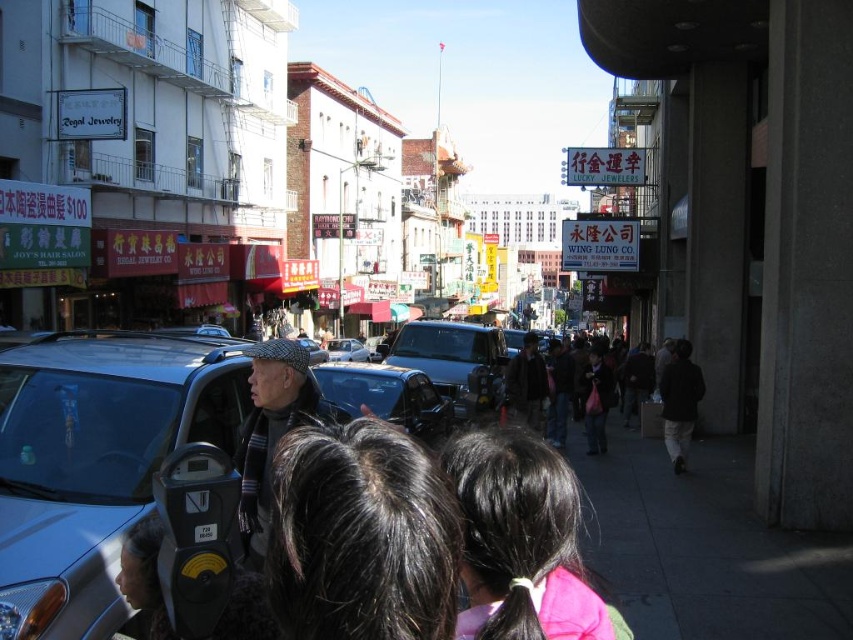
Can you confirm if gray concrete sidewalk at lower right is positioned to the left of metallic blue taxi at center?

Incorrect, gray concrete sidewalk at lower right is not on the left side of metallic blue taxi at center.

Between gray concrete sidewalk at lower right and metallic blue taxi at center, which one is positioned higher?

metallic blue taxi at center is higher up.

Is point (813, 595) positioned before point (384, 397)?

Yes, it is.

Image resolution: width=853 pixels, height=640 pixels. I want to click on gray concrete sidewalk at lower right, so click(x=704, y=547).

Which is in front, point (569, 524) or point (395, 356)?

Point (569, 524) is in front.

This screenshot has height=640, width=853. In order to click on black hair at center in this screenshot , I will do `click(521, 540)`.

Is dark brown hair at center to the right of black hair at center from the viewer's perspective?

Incorrect, dark brown hair at center is not on the right side of black hair at center.

Does point (294, 488) come in front of point (451, 481)?

Yes, point (294, 488) is closer to viewer.

This screenshot has width=853, height=640. What are the coordinates of `dark brown hair at center` in the screenshot? It's located at (361, 536).